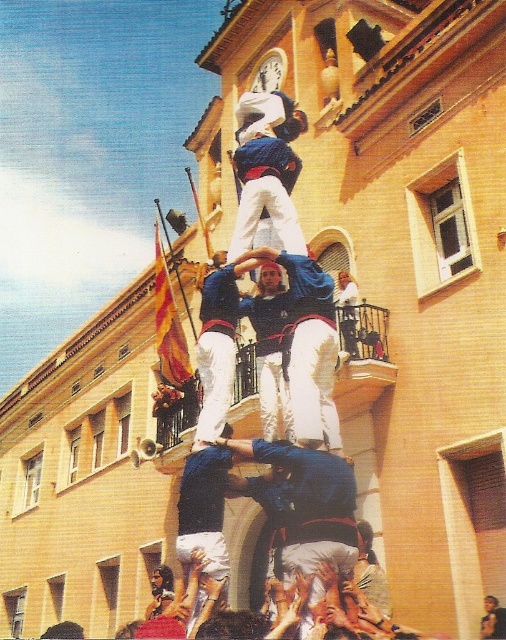
Can you confirm if blue fabric shirt at center is wider than blue denim jeans at center?

Indeed, blue fabric shirt at center has a greater width compared to blue denim jeans at center.

What do you see at coordinates (310, 348) in the screenshot? Image resolution: width=506 pixels, height=640 pixels. I see `blue fabric shirt at center` at bounding box center [310, 348].

Where is `blue fabric shirt at center`? This screenshot has width=506, height=640. blue fabric shirt at center is located at coordinates (310, 348).